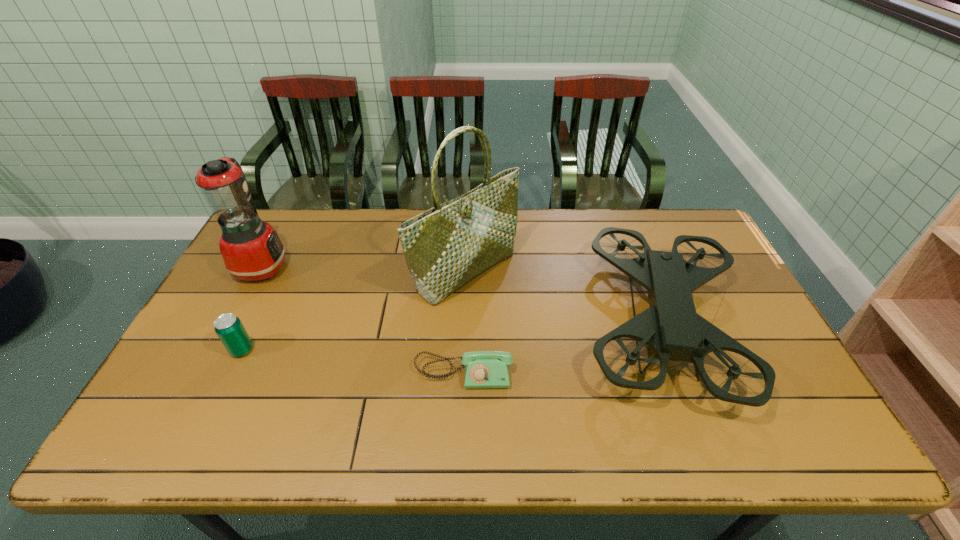
Where is `free area in between the tallest object and the third tallest object`? Image resolution: width=960 pixels, height=540 pixels. free area in between the tallest object and the third tallest object is located at coordinates (564, 297).

You are a GUI agent. You are given a task and a screenshot of the screen. Output one action in this format:
    pyautogui.click(x=<x>, y=<y>)
    Task: Click on the empty location between the fourth tallest object and the second tallest object
    This screenshot has height=540, width=960.
    Given the screenshot: What is the action you would take?
    pyautogui.click(x=252, y=308)

Image resolution: width=960 pixels, height=540 pixels. Find the location of `vacant area that lies between the drone and the beer can`. vacant area that lies between the drone and the beer can is located at coordinates (451, 336).

Identify the location of empty location between the shopping bag and the food processor. (364, 268).

Point out which object is positioned as the fourth nearest to the food processor. Please provide its 2D coordinates. Your answer should be formatted as a tuple, i.e. [(x, y)], where the tuple contains the x and y coordinates of a point satisfying the conditions above.

[(670, 326)]

You are a GUI agent. You are given a task and a screenshot of the screen. Output one action in this format:
    pyautogui.click(x=<x>, y=<y>)
    Task: Click on the second closest object relative to the tallest object
    The height and width of the screenshot is (540, 960).
    Given the screenshot: What is the action you would take?
    pyautogui.click(x=483, y=369)

This screenshot has width=960, height=540. Find the location of `free space that satisfies the following two spatial constraints: 1. on the controls of the food processor; 2. on the right side of the rightmost object`. free space that satisfies the following two spatial constraints: 1. on the controls of the food processor; 2. on the right side of the rightmost object is located at coordinates (232, 323).

Identify the location of vacant area that satisfies the following two spatial constraints: 1. on the back side of the third shortest object; 2. on the controls of the second tallest object. The width and height of the screenshot is (960, 540). (638, 266).

Find the location of `vacant space that satisfies the following two spatial constraints: 1. on the controls of the drone; 2. on the left side of the food processor`. vacant space that satisfies the following two spatial constraints: 1. on the controls of the drone; 2. on the left side of the food processor is located at coordinates (232, 323).